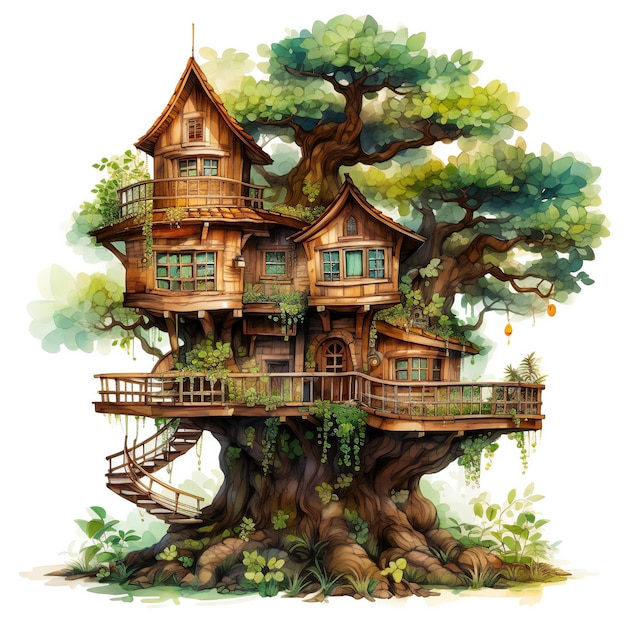
This screenshot has height=626, width=626. Find the location of `windows`. windows is located at coordinates (409, 367), (356, 262), (173, 265), (278, 255), (206, 161), (190, 162), (193, 126).